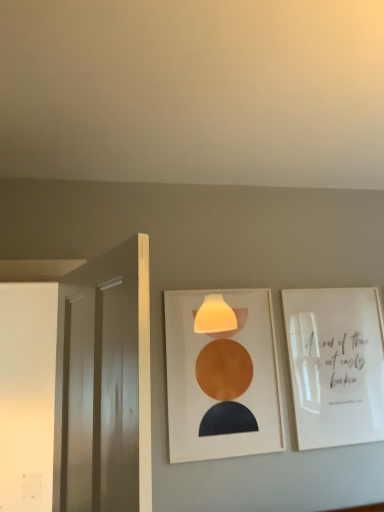
Question: From the image's perspective, is white glossy door at left above or below white glossy picture frame at upper right, which is counted as the 2th picture frame, starting from the left?

Choices:
 (A) below
 (B) above

Answer: (B)

Question: Considering the positions of white glossy door at left and white glossy picture frame at upper right, which is counted as the 2th picture frame, starting from the left, in the image, is white glossy door at left wider or thinner than white glossy picture frame at upper right, which is counted as the 2th picture frame, starting from the left,?

Choices:
 (A) wide
 (B) thin

Answer: (A)

Question: Which object is the closest to the white glossy picture frame at upper right, which is counted as the 2th picture frame, starting from the left?

Choices:
 (A) white glossy door at left
 (B) matte white picture frame at center, acting as the first picture frame starting from the left

Answer: (B)

Question: Estimate the real-world distances between objects in this image. Which object is farther from the white glossy picture frame at upper right, which is counted as the 2th picture frame, starting from the left?

Choices:
 (A) white glossy door at left
 (B) matte white picture frame at center, acting as the first picture frame starting from the left

Answer: (A)